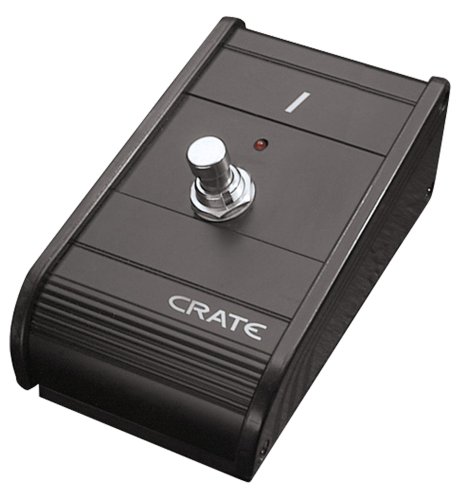
I want to click on screws, so click(440, 107), click(265, 452), click(429, 190).